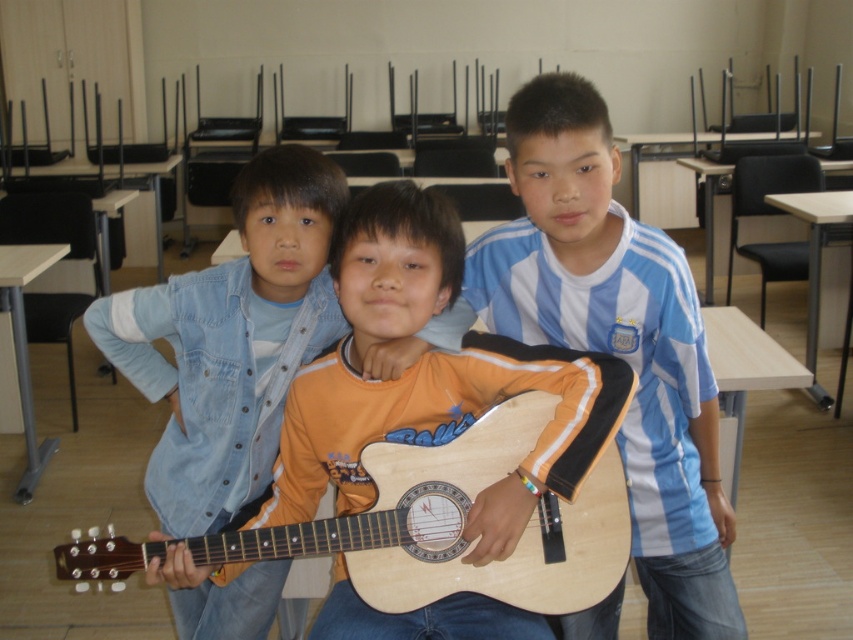
You are standing at point (567, 563) and want to move to point (653, 502). Which direction should you move?

You should move backward to reach point (653, 502) because it is behind point (567, 563).

You are a photographer setting up for a group photo. You need to ensure that the blue striped shirt at center is visible above the wooden guitar at center. Based on the scene description, is this already the case?

Yes, the blue striped shirt at center is already positioned above the wooden guitar at center according to the description.

Based on the scene description, where is the wooden guitar at center located in terms of coordinates?

The wooden guitar at center is located at point coordinates of (428, 378).